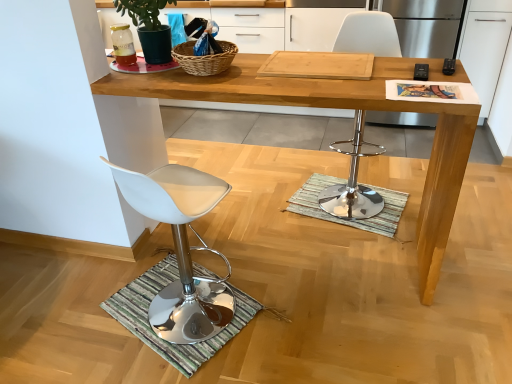
Question: Could you tell me if black plastic remote control at upper right, marked as the second remote control in a left-to-right arrangement, is turned towards woven brown picnic basket at upper center?

Choices:
 (A) yes
 (B) no

Answer: (B)

Question: Is black plastic remote control at upper right, marked as the second remote control in a left-to-right arrangement, taller than woven brown picnic basket at upper center?

Choices:
 (A) yes
 (B) no

Answer: (B)

Question: From a real-world perspective, is black plastic remote control at upper right, marked as the second remote control in a left-to-right arrangement, on woven brown picnic basket at upper center?

Choices:
 (A) yes
 (B) no

Answer: (B)

Question: Is black plastic remote control at upper right, the 1th remote control when ordered from right to left, to the right of woven brown picnic basket at upper center from the viewer's perspective?

Choices:
 (A) yes
 (B) no

Answer: (A)

Question: Considering the relative sizes of black plastic remote control at upper right, the 1th remote control when ordered from right to left, and woven brown picnic basket at upper center in the image provided, is black plastic remote control at upper right, the 1th remote control when ordered from right to left, smaller than woven brown picnic basket at upper center?

Choices:
 (A) no
 (B) yes

Answer: (B)

Question: Is black plastic remote control at upper right, the 1th remote control when ordered from right to left, wider than woven brown picnic basket at upper center?

Choices:
 (A) no
 (B) yes

Answer: (A)

Question: Is green striped mat at lower left, which is the 2th doormat from top to bottom, at the right side of black plastic remote control at upper right, the 1th remote control when ordered from right to left?

Choices:
 (A) yes
 (B) no

Answer: (B)

Question: From the image's perspective, is green striped mat at lower left, which is the 2th doormat from top to bottom, located above black plastic remote control at upper right, marked as the second remote control in a left-to-right arrangement?

Choices:
 (A) no
 (B) yes

Answer: (A)

Question: Considering the relative sizes of green striped mat at lower left, placed as the 2th doormat when sorted from right to left, and black plastic remote control at upper right, the 1th remote control when ordered from right to left, in the image provided, is green striped mat at lower left, placed as the 2th doormat when sorted from right to left, taller than black plastic remote control at upper right, the 1th remote control when ordered from right to left,?

Choices:
 (A) yes
 (B) no

Answer: (A)

Question: Considering the relative positions of green striped mat at lower left, placed as the 2th doormat when sorted from right to left, and black plastic remote control at upper right, the 1th remote control when ordered from right to left, in the image provided, is green striped mat at lower left, placed as the 2th doormat when sorted from right to left, to the left of black plastic remote control at upper right, the 1th remote control when ordered from right to left, from the viewer's perspective?

Choices:
 (A) no
 (B) yes

Answer: (B)

Question: Does green striped mat at lower left, placed as the 2th doormat when sorted from right to left, turn towards black plastic remote control at upper right, marked as the second remote control in a left-to-right arrangement?

Choices:
 (A) no
 (B) yes

Answer: (A)

Question: Is green striped mat at lower left, which is the second doormat from back to front, positioned in front of black plastic remote control at upper right, marked as the second remote control in a left-to-right arrangement?

Choices:
 (A) yes
 (B) no

Answer: (A)

Question: Considering the relative positions of chrome metallic bar stool at center, which is the 1th chair from right to left, and striped fabric doormat at center, the 1th doormat positioned from the top, in the image provided, is chrome metallic bar stool at center, which is the 1th chair from right to left, to the left of striped fabric doormat at center, the 1th doormat positioned from the top, from the viewer's perspective?

Choices:
 (A) yes
 (B) no

Answer: (B)